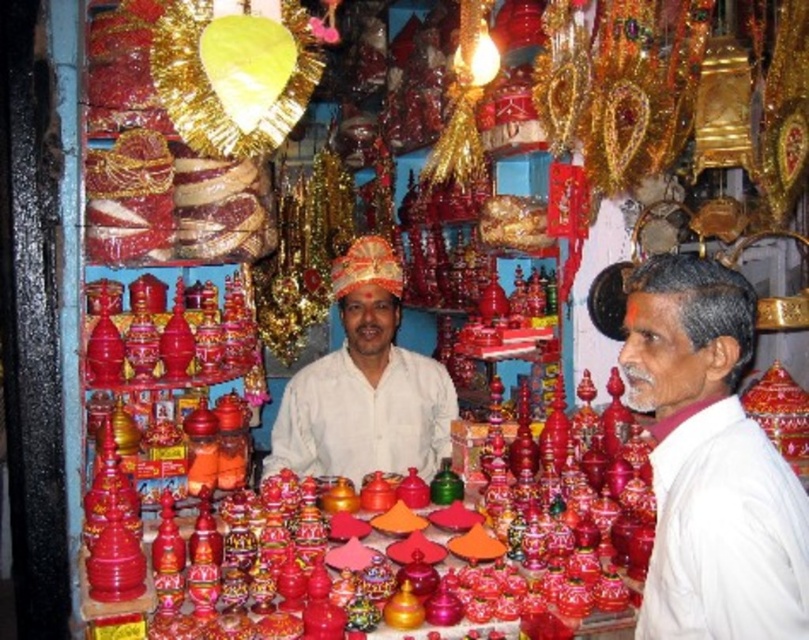
Who is shorter, white matte shirt at right or matte white cloth at center?

Standing shorter between the two is white matte shirt at right.

Measure the distance between point (767, 480) and camera.

5.64 feet

The image size is (809, 640). I want to click on white matte shirt at right, so coord(710,461).